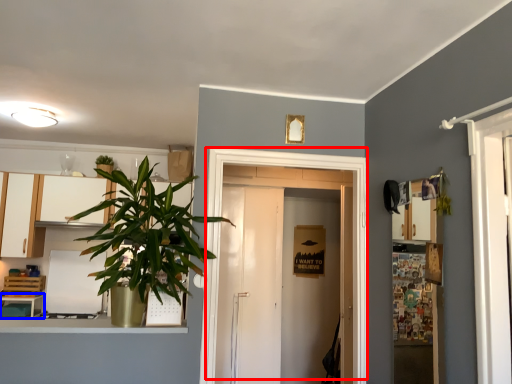
Question: Which point is further to the camera, door (highlighted by a red box) or table (highlighted by a blue box)?

Choices:
 (A) door
 (B) table

Answer: (B)